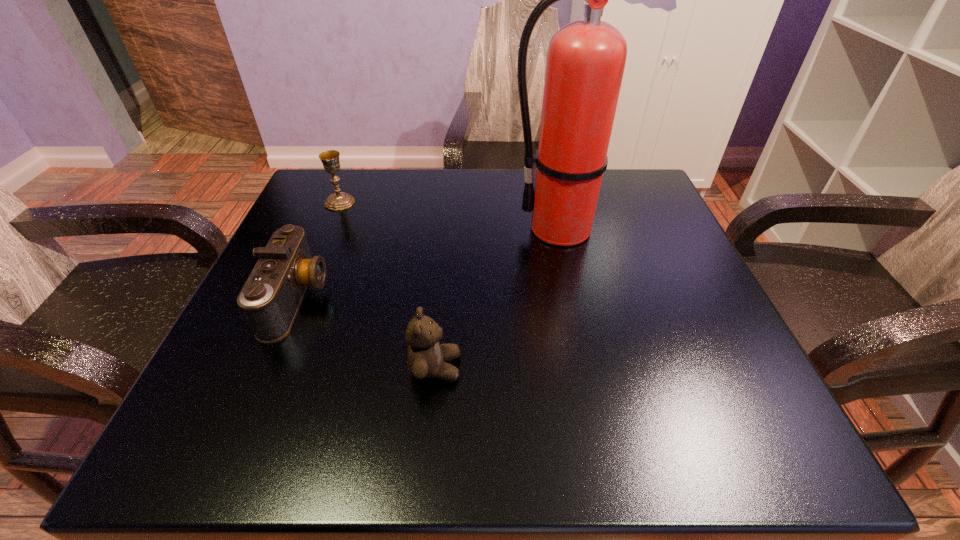
Locate an element on the screen. This screenshot has width=960, height=540. unoccupied area between the chalice and the teddy bear is located at coordinates (388, 285).

Locate an element on the screen. vacant area between the third object from left to right and the camera is located at coordinates (366, 333).

This screenshot has height=540, width=960. In order to click on vacant region between the rightmost object and the third object from left to right in this screenshot , I will do `click(499, 298)`.

At what (x,y) coordinates should I click in order to perform the action: click on free point between the fire extinguisher and the camera. Please return your answer as a coordinate pair (x, y). Looking at the image, I should click on (430, 264).

You are a GUI agent. You are given a task and a screenshot of the screen. Output one action in this format:
    pyautogui.click(x=<x>, y=<y>)
    Task: Click on the free space between the chalice and the camera
    This screenshot has width=960, height=540.
    Given the screenshot: What is the action you would take?
    pyautogui.click(x=319, y=251)

Find the location of a particular element. object identified as the second closest to the camera is located at coordinates (339, 200).

The image size is (960, 540). In order to click on object that ranks as the second closest to the fire extinguisher in this screenshot , I will do `click(271, 297)`.

The height and width of the screenshot is (540, 960). I want to click on vacant space that satisfies the following two spatial constraints: 1. on the front side of the chalice; 2. on the lens of the camera, so click(x=300, y=299).